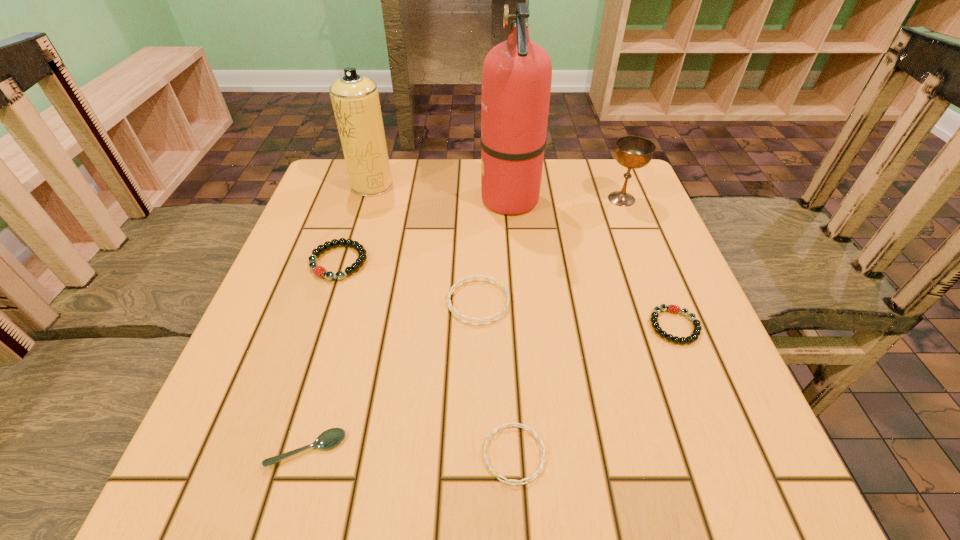
Locate an element on the screen. vacant space situated on the right of the soupspoon is located at coordinates (412, 449).

You are a GUI agent. You are given a task and a screenshot of the screen. Output one action in this format:
    pyautogui.click(x=<x>, y=<y>)
    Task: Click on the vacant point located on the surface of the nearer blue bracelet showing star-shaped elements
    
    Given the screenshot: What is the action you would take?
    pyautogui.click(x=284, y=454)

Find the location of a particular element. The image size is (960, 540). vacant space located on the surface of the nearer blue bracelet showing star-shaped elements is located at coordinates (223, 454).

Find the location of a particular element. The image size is (960, 540). blank area located 0.280m on the surface of the nearer blue bracelet showing star-shaped elements is located at coordinates (291, 454).

Where is `fire extinguisher located in the far edge section of the desktop`? This screenshot has height=540, width=960. fire extinguisher located in the far edge section of the desktop is located at coordinates (516, 79).

Locate an element on the screen. This screenshot has height=540, width=960. aerosol can at the far edge is located at coordinates (355, 99).

Locate an element on the screen. The image size is (960, 540). chalice present at the far edge is located at coordinates (633, 152).

Find the location of `soupspoon at the near edge`. soupspoon at the near edge is located at coordinates (330, 438).

At what (x,y) coordinates should I click in order to perform the action: click on bracelet at the near edge. Please return your answer as a coordinate pair (x, y). The width and height of the screenshot is (960, 540). Looking at the image, I should click on (523, 426).

Where is `aerosol can that is at the left edge`? aerosol can that is at the left edge is located at coordinates (355, 99).